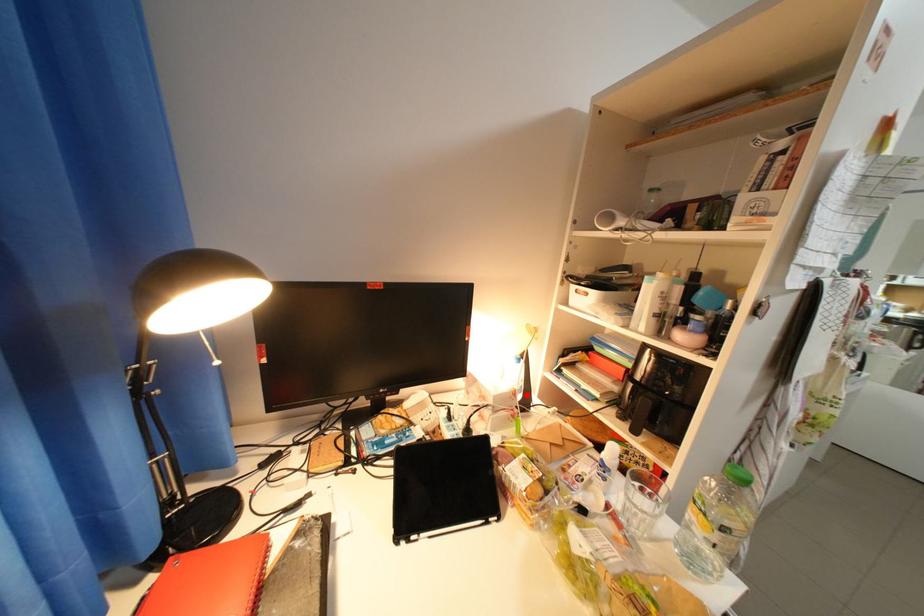
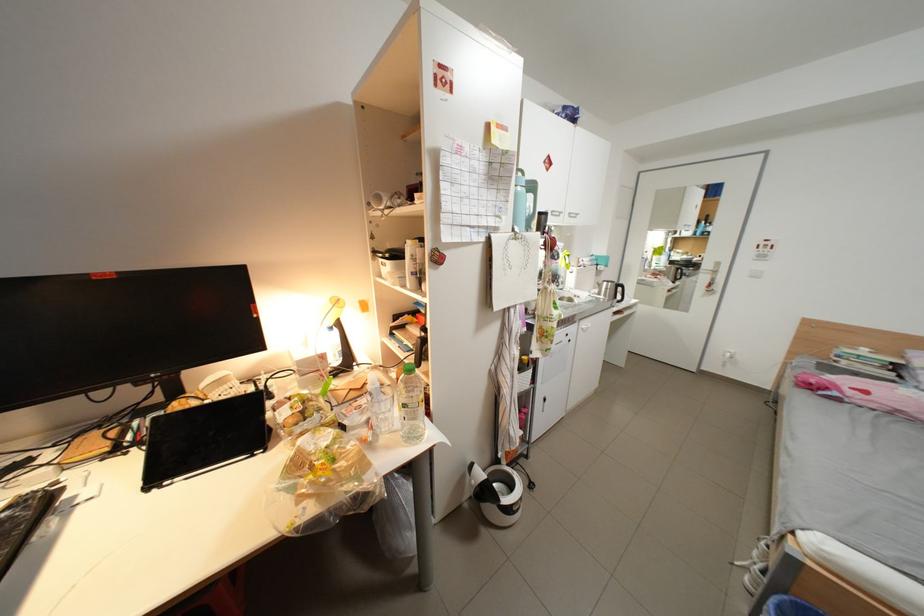
Find the pixel in the second image that matches the highlighted location in the first image.

(334, 358)